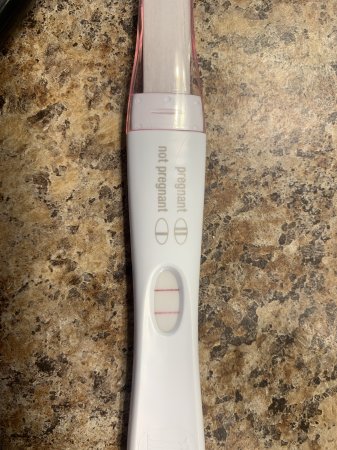
The height and width of the screenshot is (450, 337). In order to click on table/counter off edge in this screenshot , I will do `click(17, 13)`.